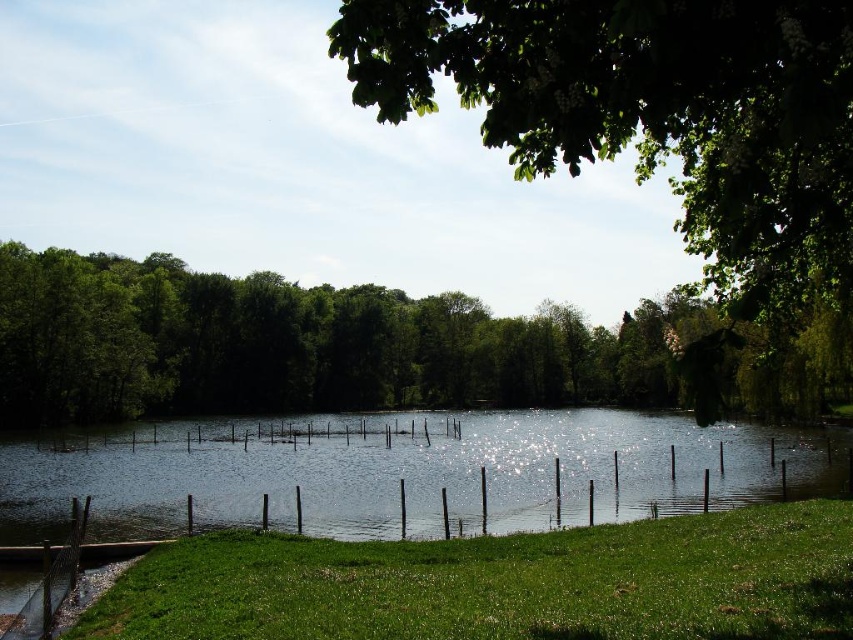
Question: Can you confirm if green leafy tree at center is positioned below green leafy tree at upper right?

Choices:
 (A) no
 (B) yes

Answer: (B)

Question: Can you confirm if green grass at lower left is positioned below clear water at center?

Choices:
 (A) no
 (B) yes

Answer: (A)

Question: Among these objects, which one is farthest from the camera?

Choices:
 (A) green leafy tree at upper right
 (B) green grass at lower left

Answer: (B)

Question: Which object appears farthest from the camera in this image?

Choices:
 (A) clear water at center
 (B) green grass at lower left
 (C) green leafy tree at upper right

Answer: (A)

Question: Among these points, which one is nearest to the camera?

Choices:
 (A) (685, 582)
 (B) (601, 40)
 (C) (160, 445)
 (D) (106, 264)

Answer: (B)

Question: Where is green leafy tree at center located in relation to green leafy tree at upper right in the image?

Choices:
 (A) below
 (B) above

Answer: (A)